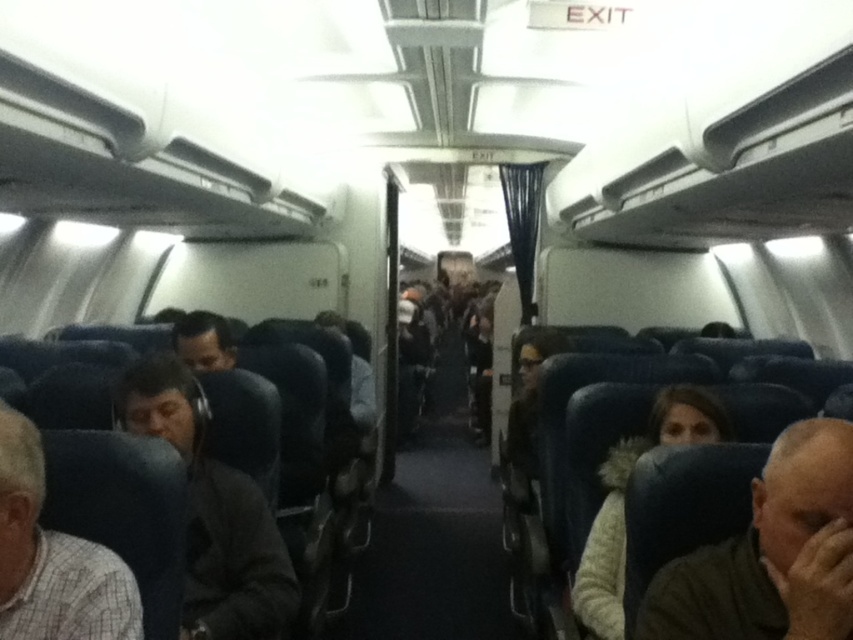
Question: Does dark gray fabric headrest at lower right have a smaller size compared to black matte headphones at left?

Choices:
 (A) yes
 (B) no

Answer: (A)

Question: Which of the following is the closest to the observer?

Choices:
 (A) black matte headphones at left
 (B) dark gray fabric headrest at lower right

Answer: (B)

Question: Is dark gray fabric headrest at lower right thinner than white fuzzy sweater at center?

Choices:
 (A) no
 (B) yes

Answer: (B)

Question: Which object is farther from the camera taking this photo?

Choices:
 (A) white checkered shirt at left
 (B) white fuzzy sweater at center

Answer: (B)

Question: Is dark gray fabric headrest at lower right below white checkered shirt at left?

Choices:
 (A) no
 (B) yes

Answer: (B)

Question: Estimate the real-world distances between objects in this image. Which object is farther from the white checkered shirt at left?

Choices:
 (A) white fuzzy sweater at center
 (B) dark gray fabric headrest at lower right

Answer: (A)